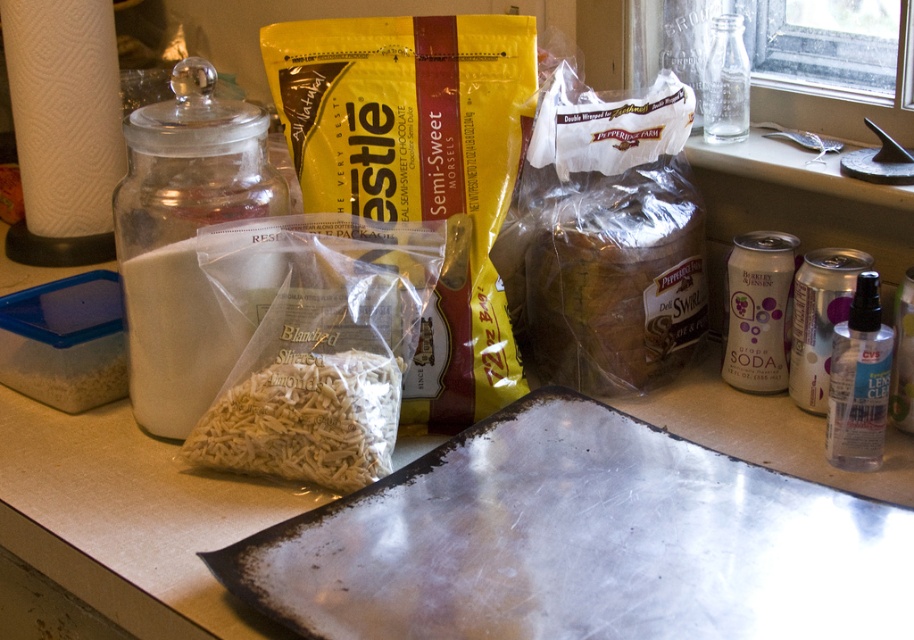
Between metallic silver baking sheet at lower center and white powder at left, which one is positioned higher?

Positioned higher is white powder at left.

Is metallic silver baking sheet at lower center positioned at the back of white powder at left?

That is False.

This screenshot has width=914, height=640. I want to click on metallic silver baking sheet at lower center, so click(580, 541).

In order to click on metallic silver baking sheet at lower center in this screenshot , I will do [580, 541].

Describe the element at coordinates (304, 419) in the screenshot. I see `white textured shredded mozzarella at center` at that location.

The width and height of the screenshot is (914, 640). Find the location of `white textured shredded mozzarella at center`. white textured shredded mozzarella at center is located at coordinates (304, 419).

Is metallic silver baking sheet at lower center thinner than white textured shredded mozzarella at center?

No.

Describe the element at coordinates (580, 541) in the screenshot. I see `metallic silver baking sheet at lower center` at that location.

Image resolution: width=914 pixels, height=640 pixels. I want to click on metallic silver baking sheet at lower center, so click(580, 541).